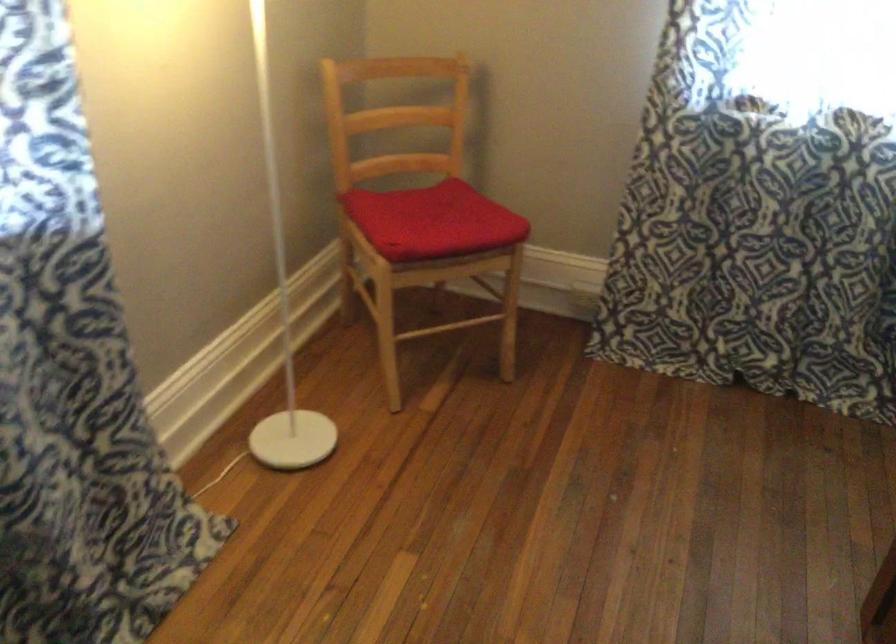
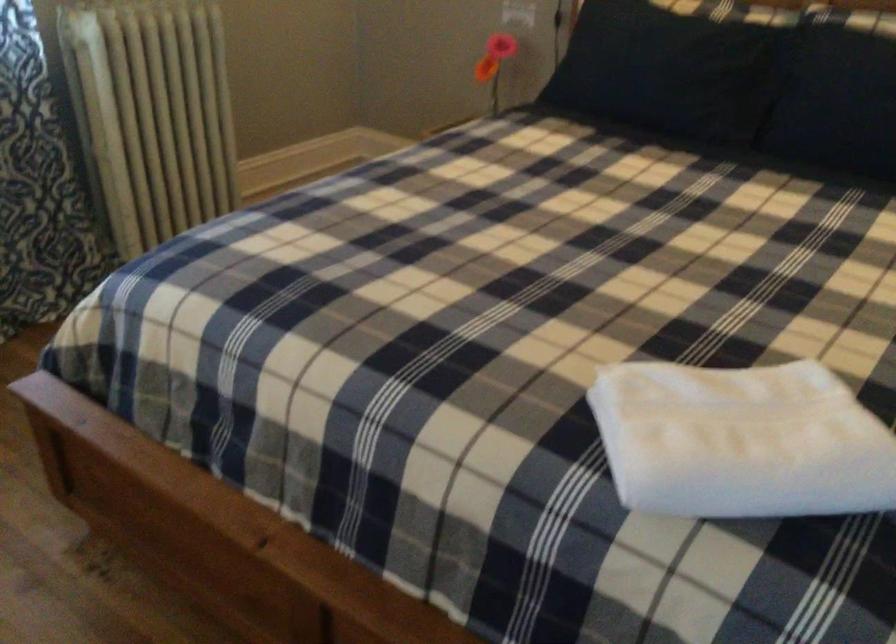
First-person continuous shooting, in which direction is the camera rotating?

The rotation direction of the camera is right-down.